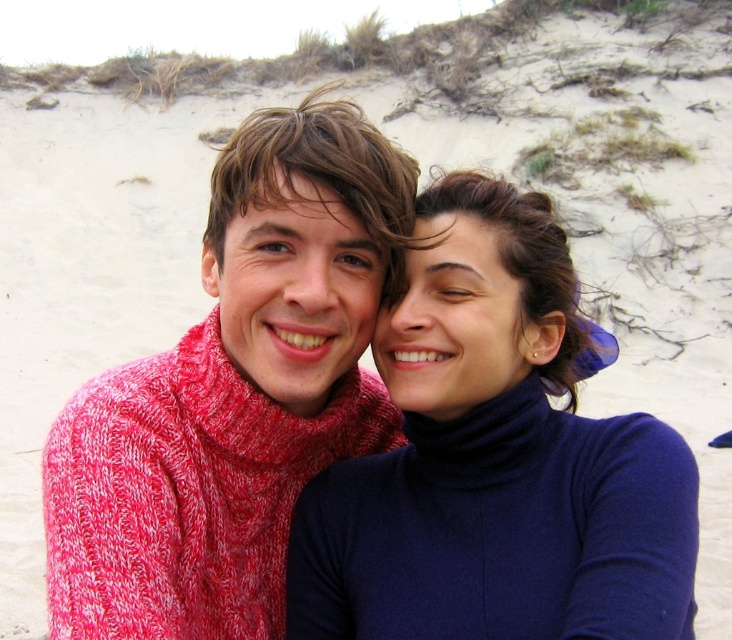
You are standing at the camera position and want to throw a frisbee to a friend who is holding the matte blue turtleneck at center. If the frisbee flies straight, will it pass over the sandy dune in the background?

The distance between the matte blue turtleneck at center and the camera is 3.00 meters. Since the sandy dune is part of the background behind the person, the frisbee thrown straight would not pass over the dune but would instead go towards the person or beyond them, not over the dune.

Consider the image. You are designing a new clothing line and want to create a matching set using both the matte blue turtleneck at center and the knitted red sweater at center. If the pattern requires the two garments to be worn side by side with equal width, would you need to adjust the design of either garment based on their current widths?

The matte blue turtleneck at center might be wider than knitted red sweater at center, so adjustments may be needed to ensure both garments have equal width when worn side by side.

What are the coordinates of the matte blue turtleneck at center?

The coordinates of the matte blue turtleneck at center are at point (496, 461).